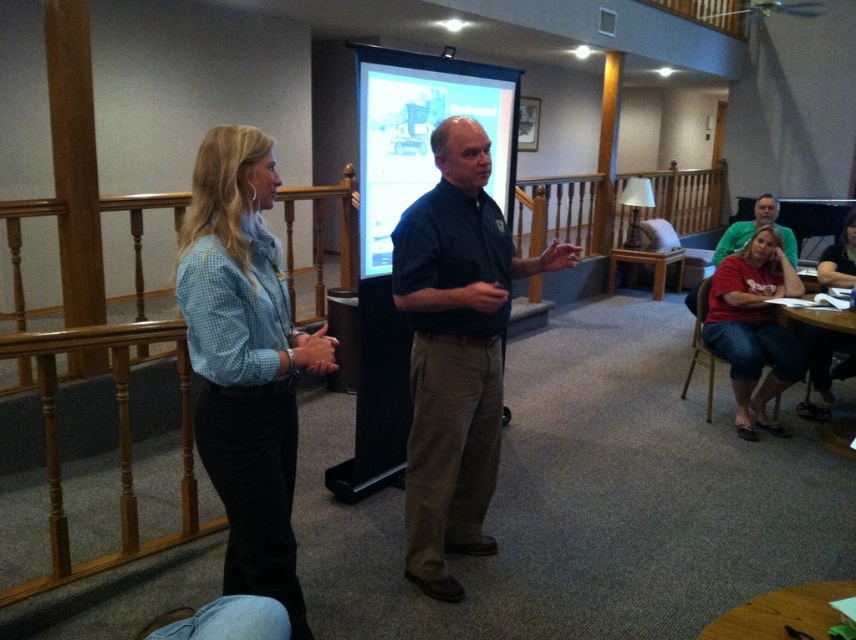
What do you see at coordinates (455, 349) in the screenshot? Image resolution: width=856 pixels, height=640 pixels. I see `dark blue shirt at center` at bounding box center [455, 349].

Can you confirm if dark blue shirt at center is shorter than red cotton shirt at lower right?

Incorrect, dark blue shirt at center's height does not fall short of red cotton shirt at lower right's.

Image resolution: width=856 pixels, height=640 pixels. Identify the location of dark blue shirt at center. (455, 349).

Who is higher up, red cotton shirt at lower right or denim shirt at lower right?

red cotton shirt at lower right is above.

Identify the location of red cotton shirt at lower right. The image size is (856, 640). (753, 326).

Can you confirm if matte black projector screen at center is positioned below denim shirt at lower right?

Actually, matte black projector screen at center is above denim shirt at lower right.

Who is shorter, matte black projector screen at center or denim shirt at lower right?

denim shirt at lower right is shorter.

Find the location of a particular element. matte black projector screen at center is located at coordinates (423, 134).